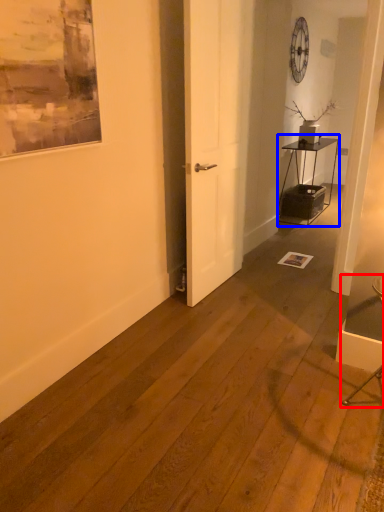
Question: Among these objects, which one is nearest to the camera, armchair (highlighted by a red box) or table (highlighted by a blue box)?

Choices:
 (A) armchair
 (B) table

Answer: (A)